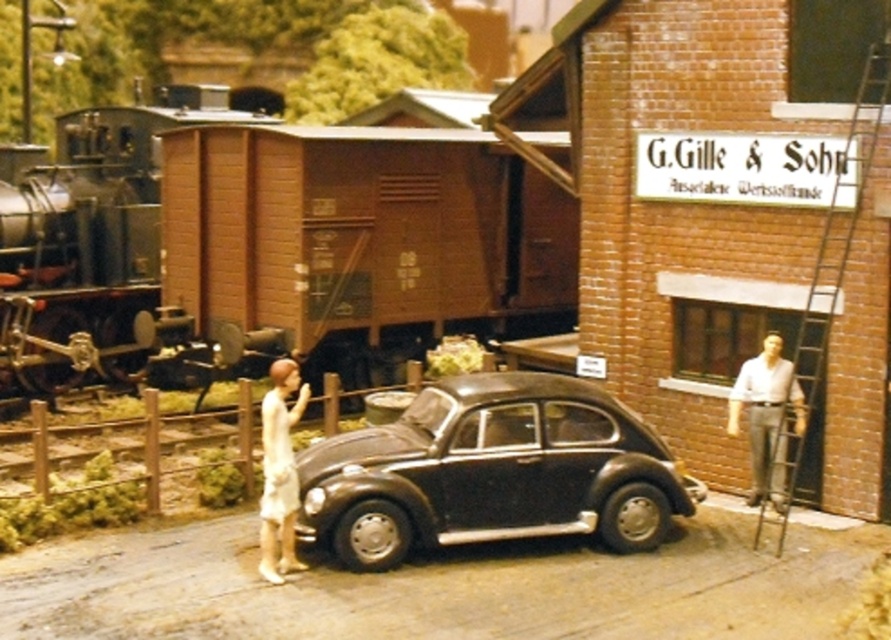
Question: Which point is farther to the camera?

Choices:
 (A) light blue shirt at right
 (B) matte black car at center
 (C) white cloth at center

Answer: (A)

Question: Estimate the real-world distances between objects in this image. Which object is farther from the matte black car at center?

Choices:
 (A) light blue shirt at right
 (B) brown wooden train at center

Answer: (B)

Question: Does matte black car at center appear over light blue shirt at right?

Choices:
 (A) no
 (B) yes

Answer: (A)

Question: Is brown wooden train at center smaller than white cloth at center?

Choices:
 (A) yes
 (B) no

Answer: (B)

Question: Which point appears farthest from the camera in this image?

Choices:
 (A) (774, 397)
 (B) (508, 188)
 (C) (372, 557)

Answer: (B)

Question: Is brown wooden train at center to the left of light blue shirt at right from the viewer's perspective?

Choices:
 (A) yes
 (B) no

Answer: (A)